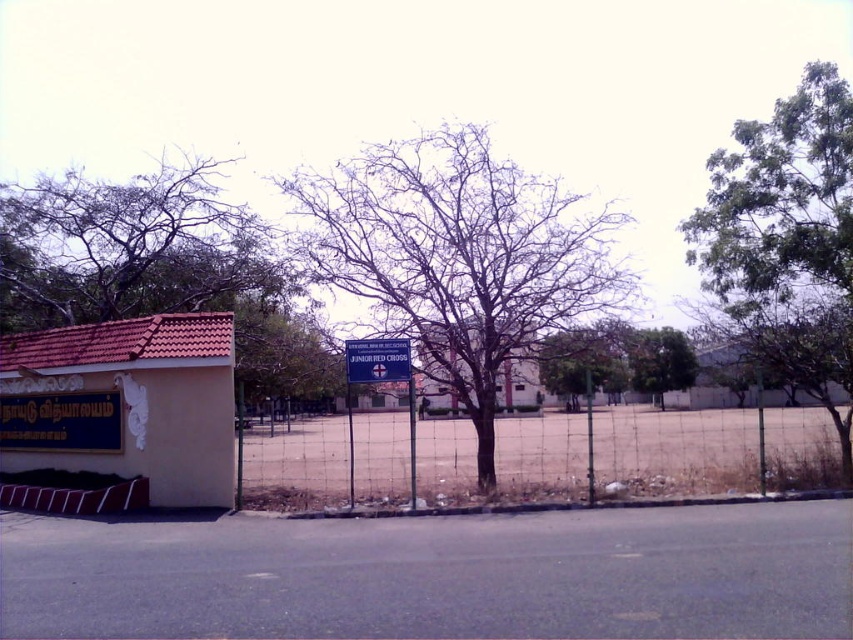
Between green leafy tree at upper right and blue plastic sign at center, which one appears on the left side from the viewer's perspective?

blue plastic sign at center is more to the left.

Measure the distance between green leafy tree at upper right and camera.

A distance of 14.88 meters exists between green leafy tree at upper right and camera.

Is point (679, 355) positioned behind point (351, 353)?

Yes, point (679, 355) is farther from viewer.

This screenshot has width=853, height=640. I want to click on green leafy tree at upper right, so click(660, 362).

Is green leafy tree at right closer to camera compared to yellow matte sign at lower left?

Yes, green leafy tree at right is in front of yellow matte sign at lower left.

Locate an element on the screen. The image size is (853, 640). green leafy tree at right is located at coordinates (787, 240).

Is point (779, 248) positioned before point (26, 424)?

That is True.

This screenshot has height=640, width=853. I want to click on green leafy tree at right, so click(787, 240).

Which of these two, brown textured tree at left or green leafy tree at upper right, stands shorter?

With less height is green leafy tree at upper right.

Is brown textured tree at left below green leafy tree at upper right?

Incorrect, brown textured tree at left is not positioned below green leafy tree at upper right.

The width and height of the screenshot is (853, 640). I want to click on brown textured tree at left, so click(126, 244).